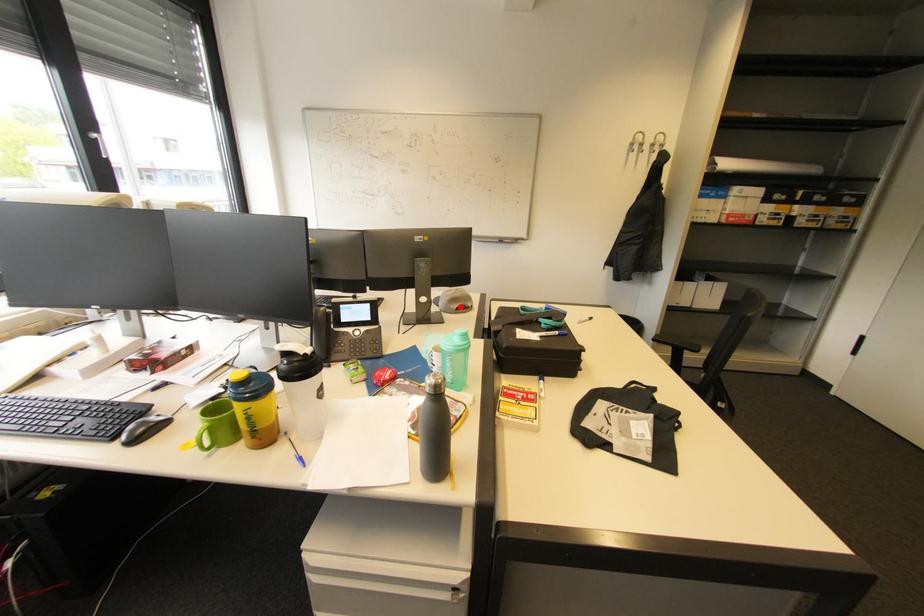
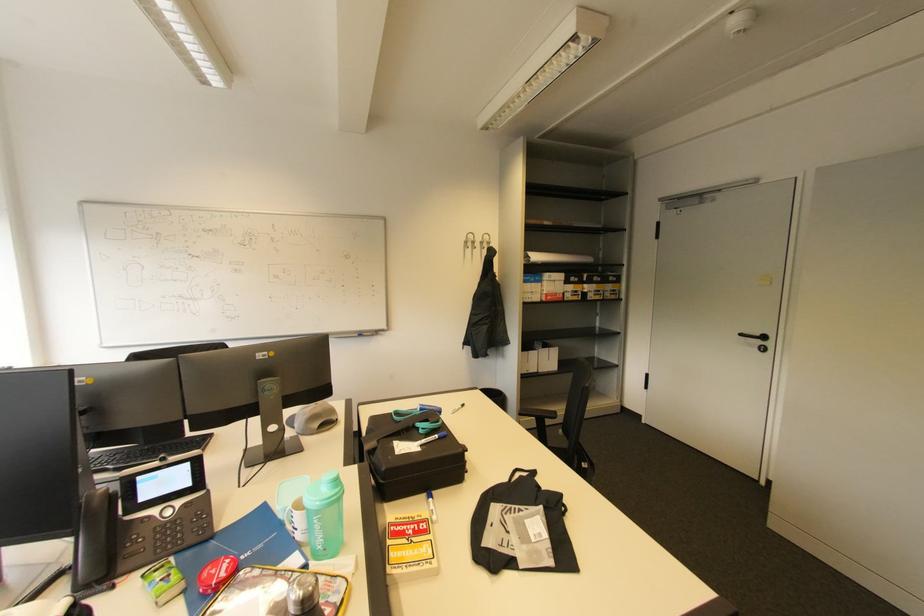
Where in the second image is the point corresponding to the highlighted location from the first image?

(321, 426)